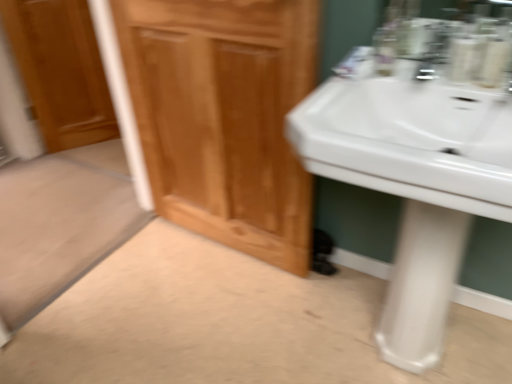
This screenshot has height=384, width=512. I want to click on free space below white glossy sink at right (from a real-world perspective), so click(x=356, y=326).